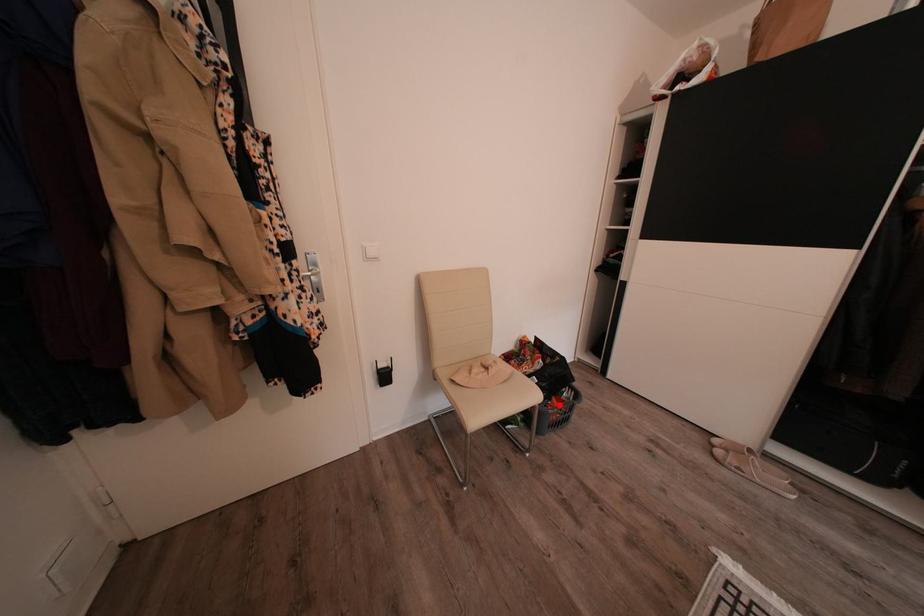
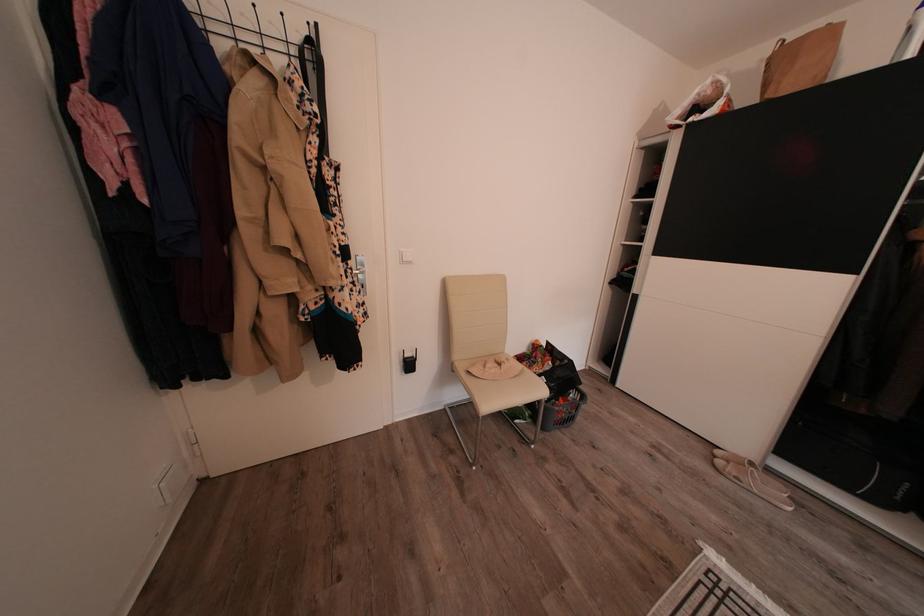
The point at the highlighted location is marked in the first image. Where is the corresponding point in the second image?

(565, 405)